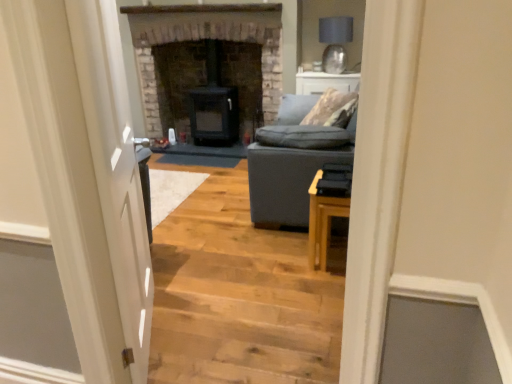
Question: Should I look upward or downward to see dark gray fabric couch at center?

Choices:
 (A) down
 (B) up

Answer: (B)

Question: Is dark gray stone fireplace at center, arranged as the 1th fireplace when viewed from the left, at the right side of white glossy door at left?

Choices:
 (A) yes
 (B) no

Answer: (A)

Question: Is dark gray stone fireplace at center, positioned as the 2th fireplace in right-to-left order, behind white glossy door at left?

Choices:
 (A) no
 (B) yes

Answer: (B)

Question: Is dark gray stone fireplace at center, arranged as the 1th fireplace when viewed from the left, positioned far away from white glossy door at left?

Choices:
 (A) no
 (B) yes

Answer: (B)

Question: Can you confirm if dark gray stone fireplace at center, positioned as the 2th fireplace in right-to-left order, is positioned to the left of white glossy door at left?

Choices:
 (A) yes
 (B) no

Answer: (B)

Question: Is dark gray stone fireplace at center, positioned as the 2th fireplace in right-to-left order, positioned with its back to white glossy door at left?

Choices:
 (A) no
 (B) yes

Answer: (A)

Question: Does dark gray stone fireplace at center, arranged as the 1th fireplace when viewed from the left, have a greater height compared to white glossy door at left?

Choices:
 (A) yes
 (B) no

Answer: (B)

Question: Is white glossy door at left located within black matte wood stove at center, which appears as the 2th fireplace when viewed from the left?

Choices:
 (A) yes
 (B) no

Answer: (B)

Question: Does black matte wood stove at center, which appears as the 2th fireplace when viewed from the left, have a greater height compared to white glossy door at left?

Choices:
 (A) yes
 (B) no

Answer: (B)

Question: Considering the relative sizes of black matte wood stove at center, which ranks as the 1th fireplace in right-to-left order, and white glossy door at left in the image provided, is black matte wood stove at center, which ranks as the 1th fireplace in right-to-left order, bigger than white glossy door at left?

Choices:
 (A) yes
 (B) no

Answer: (A)

Question: From a real-world perspective, is black matte wood stove at center, which ranks as the 1th fireplace in right-to-left order, located higher than white glossy door at left?

Choices:
 (A) yes
 (B) no

Answer: (B)

Question: Is black matte wood stove at center, which ranks as the 1th fireplace in right-to-left order, completely or partially outside of white glossy door at left?

Choices:
 (A) yes
 (B) no

Answer: (A)

Question: Is white glossy door at left at the back of black matte wood stove at center, which appears as the 2th fireplace when viewed from the left?

Choices:
 (A) no
 (B) yes

Answer: (A)

Question: Is dark gray stone fireplace at center, arranged as the 1th fireplace when viewed from the left, smaller than black matte wood stove at center, which appears as the 2th fireplace when viewed from the left?

Choices:
 (A) yes
 (B) no

Answer: (B)